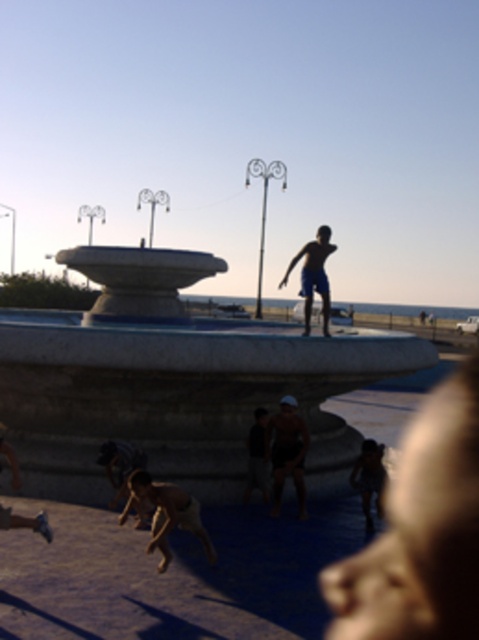
You are a photographer standing at the edge of the square. You want to capture a photo of the white marble fountain at center without any people in the frame. However, there are blue matte shorts at center blocking the view. Based on their positions, can you determine if the fountain is visible behind the shorts?

The white marble fountain at center is located below the blue matte shorts at center, meaning the fountain is positioned behind the shorts. Since the fountain is below the shorts, it might still be partially visible depending on the angle and height of the photographer. However, the shorts are directly in the center, so they would likely obscure the fountain in a straight shot. To capture the fountain without obstruction, you might need to adjust your position or angle to avoid the shorts.

You are standing in the public square and want to take a photo of both the point at coordinates point (252, 372) and point (326, 246). Which point should you focus on first to ensure both are in focus?

You should focus on the point at coordinates point (252, 372) first because it is closer to the camera than point (326, 246). This ensures that both points will be in focus as the depth of field will cover the distance between them.